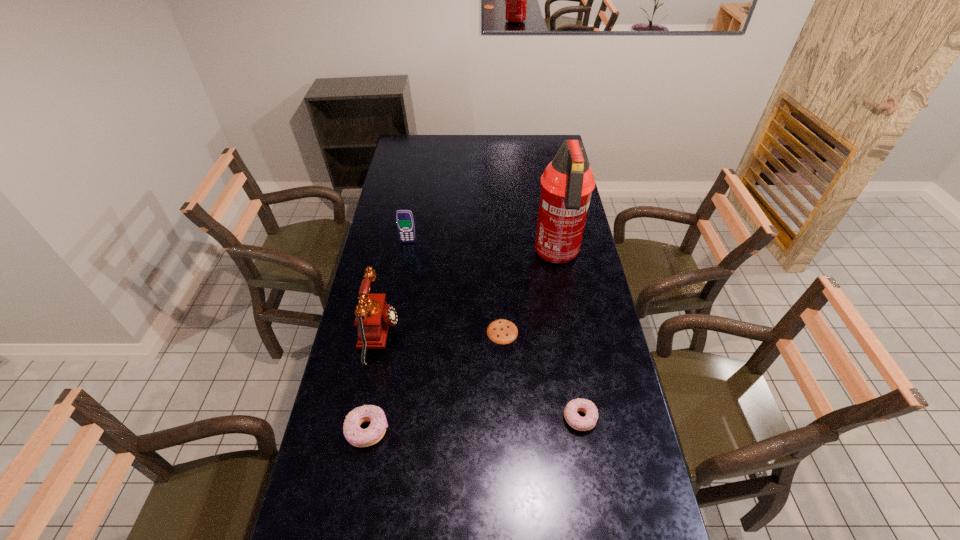
I want to click on vacant space situated on the back of the fifth tallest object, so pyautogui.click(x=568, y=347).

This screenshot has width=960, height=540. In order to click on free space located on the front-facing side of the third tallest object in this screenshot , I will do `click(397, 302)`.

Locate an element on the screen. vacant area located 0.110m on the trigger side of the tallest object is located at coordinates (564, 299).

The height and width of the screenshot is (540, 960). Find the location of `blank space located on the dial of the telephone`. blank space located on the dial of the telephone is located at coordinates (421, 335).

Find the location of a particular element. This screenshot has width=960, height=540. free space located on the left of the fourth object from left to right is located at coordinates (416, 332).

Where is `doughnut at the left edge`? The height and width of the screenshot is (540, 960). doughnut at the left edge is located at coordinates (354, 434).

I want to click on cellular telephone located in the left edge section of the desktop, so click(x=404, y=218).

Identify the location of telephone situated at the left edge. (374, 316).

Locate an element on the screen. This screenshot has width=960, height=540. doughnut at the right edge is located at coordinates click(586, 423).

What are the coordinates of `fire extinguisher located at the right edge` in the screenshot? It's located at (567, 183).